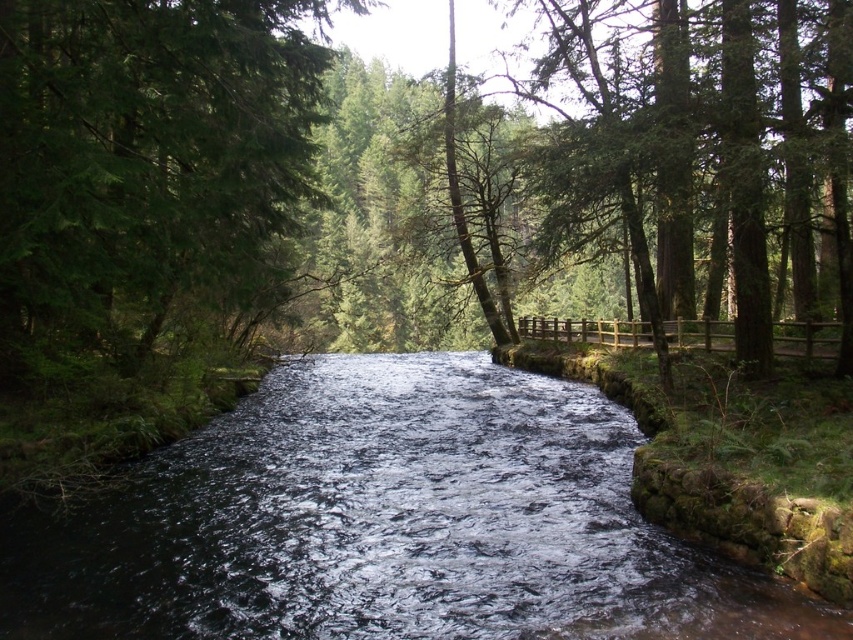
Question: Which point is closer to the camera?

Choices:
 (A) (230, 147)
 (B) (57, 589)

Answer: (B)

Question: Which point is closer to the camera taking this photo?

Choices:
 (A) (9, 92)
 (B) (251, 500)

Answer: (A)

Question: Which of the following is the closest to the observer?

Choices:
 (A) dark water at center
 (B) green textured tree at upper left

Answer: (A)

Question: Does dark water at center lie behind green textured tree at upper left?

Choices:
 (A) no
 (B) yes

Answer: (A)

Question: Considering the relative positions of dark water at center and green textured tree at upper left in the image provided, where is dark water at center located with respect to green textured tree at upper left?

Choices:
 (A) above
 (B) below

Answer: (B)

Question: Can you confirm if dark water at center is thinner than green textured tree at upper left?

Choices:
 (A) no
 (B) yes

Answer: (A)